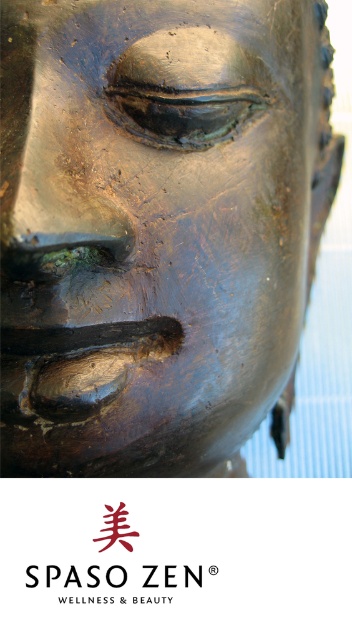
Where is the bronze sculpture at center located in the image?

The bronze sculpture at center is located at point coordinates of (156,227).

You are an art conservator examining the bronze sculpture. You notice two points on the sculpture, labeled as point (154,417) and point (107,586). Which point is closer to the camera?

Point (154,417) is further to the camera than point (107,586), so the point closer to the camera is point (107,586).